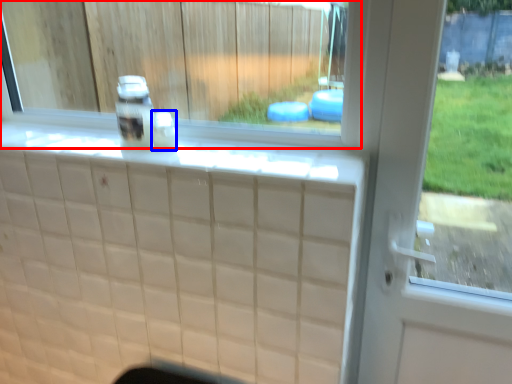
Question: Which of the following is the farthest to the observer, window (highlighted by a red box) or bottle (highlighted by a blue box)?

Choices:
 (A) window
 (B) bottle

Answer: (B)